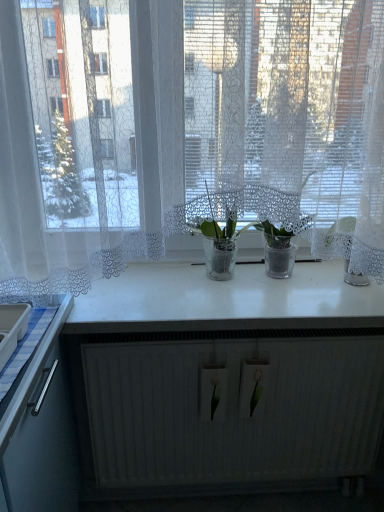
Locate an element on the screen. vacant space underneath translucent glass vase at center (from a real-world perspective) is located at coordinates (218, 278).